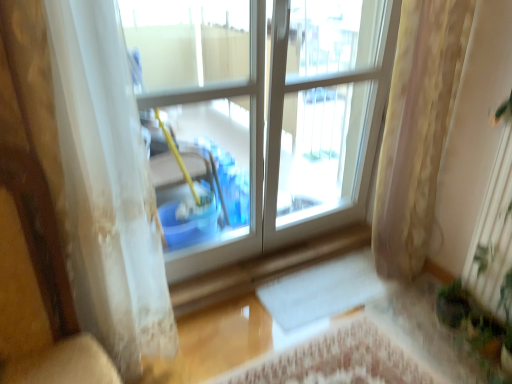
Question: From the image's perspective, is white sheer curtain at left, which is counted as the 1th curtain, starting from the left, above transparent plastic bucket at center?

Choices:
 (A) no
 (B) yes

Answer: (A)

Question: Is white sheer curtain at left, which is counted as the 1th curtain, starting from the left, with transparent plastic bucket at center?

Choices:
 (A) no
 (B) yes

Answer: (A)

Question: Is white sheer curtain at left, which is counted as the 1th curtain, starting from the left, further to the viewer compared to transparent plastic bucket at center?

Choices:
 (A) yes
 (B) no

Answer: (B)

Question: From a real-world perspective, is white sheer curtain at left, which is the second curtain in right-to-left order, beneath transparent plastic bucket at center?

Choices:
 (A) yes
 (B) no

Answer: (A)

Question: Does white sheer curtain at left, which is counted as the 1th curtain, starting from the left, have a greater height compared to transparent plastic bucket at center?

Choices:
 (A) no
 (B) yes

Answer: (B)

Question: Would you say white sheer curtain at left, which is the second curtain in right-to-left order, contains transparent plastic bucket at center?

Choices:
 (A) yes
 (B) no

Answer: (B)

Question: Is the position of transparent plastic bucket at center more distant than that of white sheer curtain at left, which is the second curtain in right-to-left order?

Choices:
 (A) yes
 (B) no

Answer: (A)

Question: From the image's perspective, is transparent plastic bucket at center located beneath white sheer curtain at left, which is counted as the 1th curtain, starting from the left?

Choices:
 (A) yes
 (B) no

Answer: (B)

Question: Does transparent plastic bucket at center have a smaller size compared to white sheer curtain at left, which is the second curtain in right-to-left order?

Choices:
 (A) yes
 (B) no

Answer: (A)

Question: Could you tell me if transparent plastic bucket at center is turned towards white sheer curtain at left, which is counted as the 1th curtain, starting from the left?

Choices:
 (A) no
 (B) yes

Answer: (A)

Question: Are transparent plastic bucket at center and white sheer curtain at left, which is counted as the 1th curtain, starting from the left, beside each other?

Choices:
 (A) no
 (B) yes

Answer: (A)

Question: From a real-world perspective, is transparent plastic bucket at center physically below white sheer curtain at left, which is the second curtain in right-to-left order?

Choices:
 (A) no
 (B) yes

Answer: (A)

Question: Is green leafy plant at lower right not close to wooden armchair at left?

Choices:
 (A) yes
 (B) no

Answer: (A)